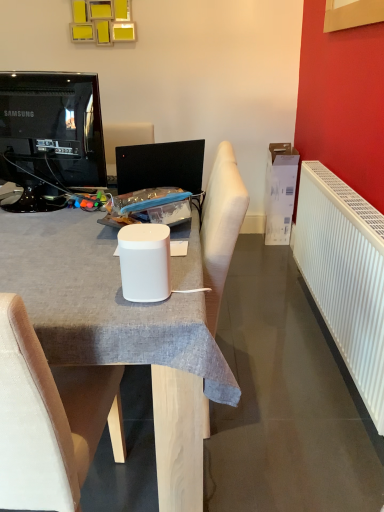
This screenshot has width=384, height=512. Describe the element at coordinates (110, 273) in the screenshot. I see `white matte speaker at center` at that location.

This screenshot has height=512, width=384. What do you see at coordinates (145, 262) in the screenshot?
I see `white matte speaker at center` at bounding box center [145, 262].

What do you see at coordinates (50, 137) in the screenshot? I see `black glossy television at upper left` at bounding box center [50, 137].

I want to click on black glossy television at upper left, so click(x=50, y=137).

Measure the distance between point (83,383) and camera.

Point (83,383) is 3.79 feet away from camera.

Locate an element on the screen. The height and width of the screenshot is (512, 384). white matte speaker at center is located at coordinates tap(110, 273).

Considering the relative sizes of white fabric chair at center and white matte speaker at center in the image provided, is white fabric chair at center wider than white matte speaker at center?

Yes.

Is white fabric chair at center shorter than white matte speaker at center?

No.

Who is bigger, white fabric chair at center or white matte speaker at center?

white fabric chair at center.

The image size is (384, 512). Find the location of `paper cup lying behind the white fabric chair at center`. paper cup lying behind the white fabric chair at center is located at coordinates (145, 262).

Which of these two, white plastic radiator at right or black glossy television at upper left, is thinner?

white plastic radiator at right.

In terms of height, does white plastic radiator at right look taller or shorter compared to black glossy television at upper left?

white plastic radiator at right is taller than black glossy television at upper left.

Is the depth of white plastic radiator at right greater than that of black glossy television at upper left?

No, white plastic radiator at right is closer to the viewer.

Find the location of a particular element. The width and height of the screenshot is (384, 512). radiator beneath the black glossy television at upper left (from a real-world perspective) is located at coordinates (345, 274).

Between point (149, 240) and point (116, 424), which one is positioned in front?

Positioned in front is point (149, 240).

Considering the positions of objects white matte speaker at center and white fabric chair at center in the image provided, who is more to the left, white matte speaker at center or white fabric chair at center?

white fabric chair at center.

Image resolution: width=384 pixels, height=512 pixels. What are the coordinates of `desk located in front of the black glossy television at upper left` in the screenshot? It's located at (110, 273).

In the scene shown: From the image's perspective, would you say black glossy television at upper left is shown under white matte speaker at center?

Incorrect, from the image's perspective, black glossy television at upper left is higher than white matte speaker at center.

Between point (44, 82) and point (171, 505), which one is positioned in front?

The point (171, 505) is closer to the camera.

Can you tell me how much black glossy television at upper left and white matte speaker at center differ in facing direction?

166 degrees.

In terms of size, does white plastic radiator at right appear bigger or smaller than white matte speaker at center?

Considering their sizes, white plastic radiator at right takes up more space than white matte speaker at center.

Considering the sizes of white plastic radiator at right and white matte speaker at center in the image, is white plastic radiator at right wider or thinner than white matte speaker at center?

Considering their sizes, white plastic radiator at right looks broader than white matte speaker at center.

Is white plastic radiator at right surrounding white matte speaker at center?

That's incorrect, white matte speaker at center is not inside white plastic radiator at right.

Can you tell me how much white plastic radiator at right and white fabric chair at center differ in facing direction?

There is a 90-degree angle between the facing directions of white plastic radiator at right and white fabric chair at center.

Does white plastic radiator at right lie in front of white fabric chair at center?

No, it is behind white fabric chair at center.

Is white plastic radiator at right turned away from white fabric chair at center?

That's not correct — white plastic radiator at right is not looking away from white fabric chair at center.

From the image's perspective, which one is positioned lower, white plastic radiator at right or white fabric chair at center?

white fabric chair at center is shown below in the image.

Which is farther from the camera, (19, 225) or (383, 278)?

The point (19, 225) is more distant.

Considering the sizes of objects white matte speaker at center and white plastic radiator at right in the image provided, who is thinner, white matte speaker at center or white plastic radiator at right?

white plastic radiator at right is thinner.

Would you say white matte speaker at center contains white plastic radiator at right?

No, white plastic radiator at right is not inside white matte speaker at center.

Based on the photo, is white matte speaker at center oriented towards white plastic radiator at right?

No.

Where is `chair lying in front of the white matte speaker at center`? chair lying in front of the white matte speaker at center is located at coordinates (49, 418).

Find the location of a particular element. The image size is (384, 512). radiator on the right of black glossy television at upper left is located at coordinates (345, 274).

In the scene shown: Estimate the real-world distances between objects in this image. Which object is closer to white fabric chair at center, white matte speaker at center or white matte speaker at center?

Based on the image, white matte speaker at center appears to be nearer to white fabric chair at center.

Which object lies further to the anchor point white matte speaker at center, white plastic radiator at right or black glossy television at upper left?

white plastic radiator at right.

From the image, which object appears to be farther from white plastic radiator at right, white matte speaker at center or black glossy television at upper left?

Based on the image, black glossy television at upper left appears to be further to white plastic radiator at right.

When comparing their distances from white matte speaker at center, does white matte speaker at center or white plastic radiator at right seem closer?

white matte speaker at center lies closer to white matte speaker at center than the other object.

Which object lies further to the anchor point white matte speaker at center, white fabric chair at center or black glossy television at upper left?

black glossy television at upper left.

When comparing their distances from white fabric chair at center, does black glossy television at upper left or white matte speaker at center seem closer?

white matte speaker at center is positioned closer to the anchor white fabric chair at center.

When comparing their distances from white matte speaker at center, does white matte speaker at center or white fabric chair at center seem further?

Based on the image, white fabric chair at center appears to be further to white matte speaker at center.

When comparing their distances from white matte speaker at center, does white fabric chair at center or white matte speaker at center seem further?

The object further to white matte speaker at center is white fabric chair at center.

Identify the location of paper cup between white matte speaker at center and white plastic radiator at right from left to right. (145, 262).

Find the location of `paper cup that lies between black glossy television at upper left and white matte speaker at center from top to bottom`. paper cup that lies between black glossy television at upper left and white matte speaker at center from top to bottom is located at coordinates (145, 262).

At what (x,y) coordinates should I click in order to perform the action: click on chair situated between black glossy television at upper left and white plastic radiator at right from left to right. Please return your answer as a coordinate pair (x, y). Looking at the image, I should click on (49, 418).

Image resolution: width=384 pixels, height=512 pixels. In order to click on paper cup between white fabric chair at center and white plastic radiator at right from left to right in this screenshot , I will do `click(145, 262)`.